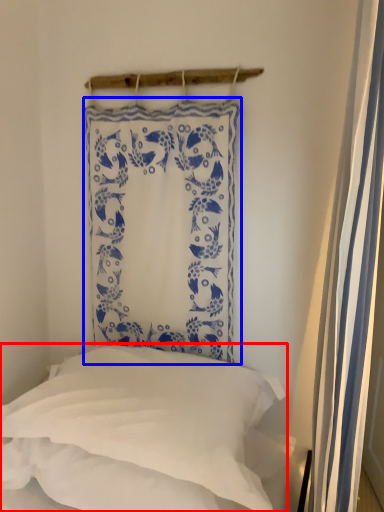
Question: Which point is further to the camera, pillow (highlighted by a red box) or curtain (highlighted by a blue box)?

Choices:
 (A) pillow
 (B) curtain

Answer: (B)